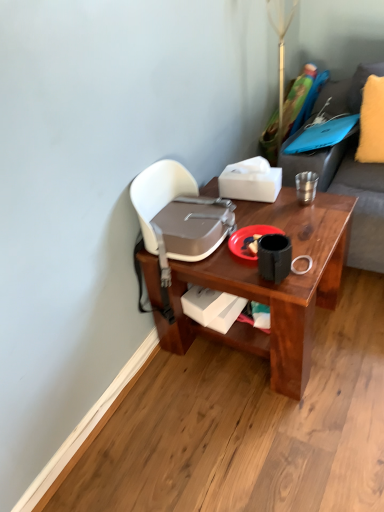
The width and height of the screenshot is (384, 512). I want to click on free space to the back side of red matte plate at center, so click(261, 215).